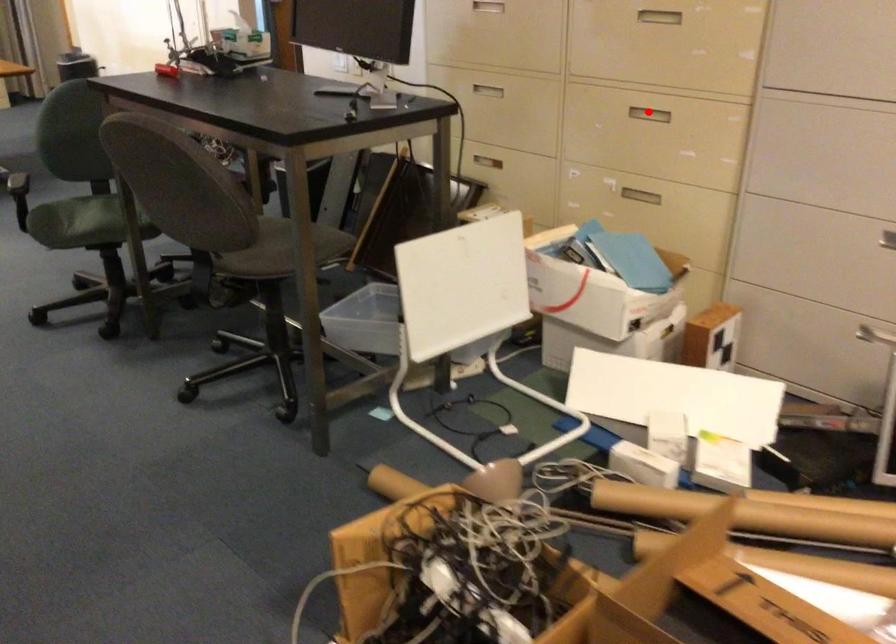
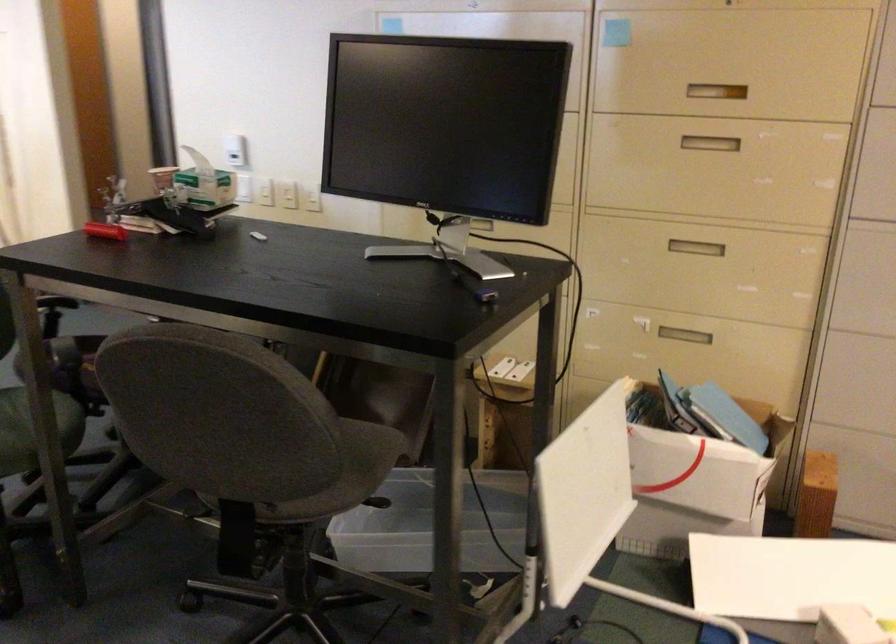
Where in the second image is the point corresponding to the highlighted location from the first image?

(695, 247)